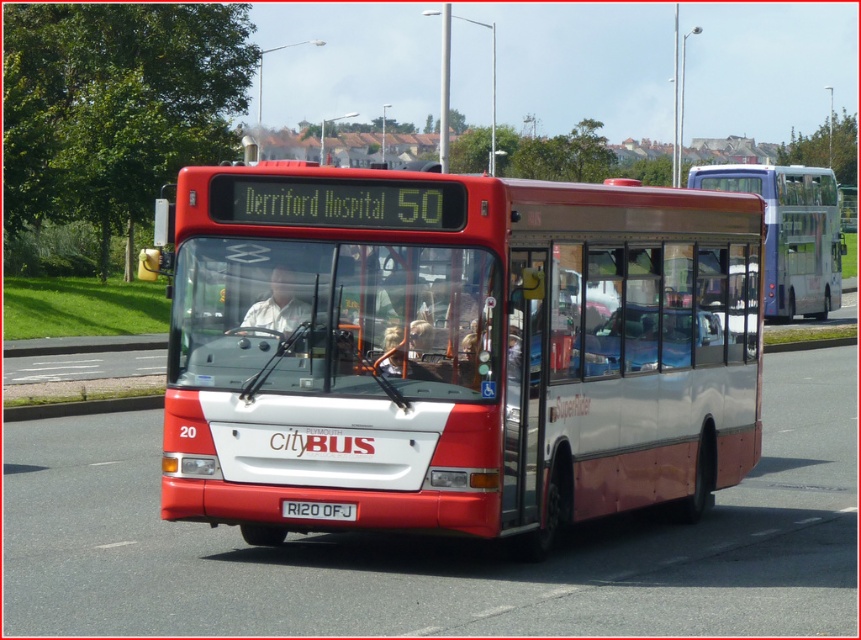
Is metallic silver bus at center in front of white plastic license plate at center?

No, it is behind white plastic license plate at center.

This screenshot has width=861, height=640. Identify the location of metallic silver bus at center. (790, 232).

Locate an element on the screen. This screenshot has height=640, width=861. metallic silver bus at center is located at coordinates (790, 232).

At what (x,y) coordinates should I click in order to perform the action: click on matte red bus at center. Please return your answer as a coordinate pair (x, y). This screenshot has height=640, width=861. Looking at the image, I should click on (457, 349).

Image resolution: width=861 pixels, height=640 pixels. What do you see at coordinates (457, 349) in the screenshot?
I see `matte red bus at center` at bounding box center [457, 349].

Who is more forward, (287, 442) or (259, 308)?

Positioned in front is point (287, 442).

You are a GUI agent. You are given a task and a screenshot of the screen. Output one action in this format:
    pyautogui.click(x=<x>, y=<y>)
    Task: Click on the matte red bus at center
    This screenshot has height=640, width=861.
    Given the screenshot: What is the action you would take?
    pyautogui.click(x=457, y=349)

Is point (660, 246) behind point (784, 170)?

That is False.

What do you see at coordinates (457, 349) in the screenshot? The image size is (861, 640). I see `matte red bus at center` at bounding box center [457, 349].

Is point (327, 212) positioned behind point (791, 276)?

No, it is not.

Image resolution: width=861 pixels, height=640 pixels. In order to click on matte red bus at center in this screenshot , I will do `click(457, 349)`.